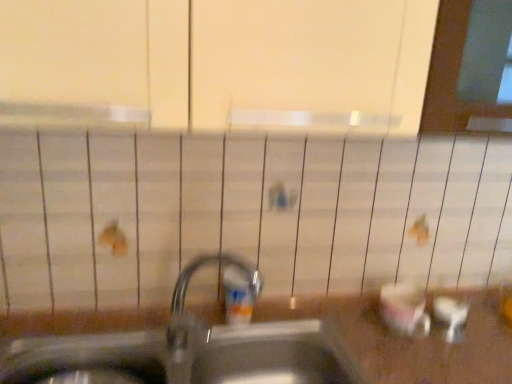
The image size is (512, 384). What do you see at coordinates (186, 351) in the screenshot?
I see `metallic sink at center` at bounding box center [186, 351].

The width and height of the screenshot is (512, 384). I want to click on metallic sink at center, so click(186, 351).

Where is `translucent plastic soap dispenser at center`? This screenshot has width=512, height=384. translucent plastic soap dispenser at center is located at coordinates (239, 295).

Describe the element at coordinates (239, 295) in the screenshot. I see `translucent plastic soap dispenser at center` at that location.

Locate an element on the screen. The height and width of the screenshot is (384, 512). metallic sink at center is located at coordinates (x=186, y=351).

Does metallic sink at center appear on the right side of translucent plastic soap dispenser at center?

No.

In the image, is metallic sink at center positioned in front of or behind translucent plastic soap dispenser at center?

Clearly, metallic sink at center is in front of translucent plastic soap dispenser at center.

Does point (30, 364) come closer to viewer compared to point (233, 268)?

Yes, it is in front of point (233, 268).

Looking at this image, from the image's perspective, is metallic sink at center located above translucent plastic soap dispenser at center?

Actually, metallic sink at center appears below translucent plastic soap dispenser at center in the image.

From a real-world perspective, relative to translucent plastic soap dispenser at center, is metallic sink at center vertically above or below?

Clearly, from a real-world perspective, metallic sink at center is below translucent plastic soap dispenser at center.

Does metallic sink at center have a lesser width compared to translucent plastic soap dispenser at center?

In fact, metallic sink at center might be wider than translucent plastic soap dispenser at center.

Considering the sizes of objects metallic sink at center and translucent plastic soap dispenser at center in the image provided, who is shorter, metallic sink at center or translucent plastic soap dispenser at center?

translucent plastic soap dispenser at center is shorter.

Between metallic sink at center and translucent plastic soap dispenser at center, which one has smaller size?

Smaller between the two is translucent plastic soap dispenser at center.

Is translucent plastic soap dispenser at center inside metallic sink at center?

No.

Are metallic sink at center and translucent plastic soap dispenser at center located far from each other?

No, metallic sink at center is not far away from translucent plastic soap dispenser at center.

Does metallic sink at center turn towards translucent plastic soap dispenser at center?

No, metallic sink at center is not turned towards translucent plastic soap dispenser at center.

How different are the orientations of metallic sink at center and translucent plastic soap dispenser at center in degrees?

The facing directions of metallic sink at center and translucent plastic soap dispenser at center are 0.661 degrees apart.

Find the location of a particular element. This screenshot has height=384, width=512. toiletry behind the metallic sink at center is located at coordinates (239, 295).

Considering the positions of objects translucent plastic soap dispenser at center and metallic sink at center in the image provided, who is more to the left, translucent plastic soap dispenser at center or metallic sink at center?

Positioned to the left is metallic sink at center.

Does translucent plastic soap dispenser at center come behind metallic sink at center?

Yes, the depth of translucent plastic soap dispenser at center is greater than that of metallic sink at center.

Is point (226, 307) positioned before point (247, 372)?

No, it is not.

From the image's perspective, is translucent plastic soap dispenser at center above or below metallic sink at center?

translucent plastic soap dispenser at center is situated higher than metallic sink at center in the image.

From a real-world perspective, between translucent plastic soap dispenser at center and metallic sink at center, who is vertically higher?

translucent plastic soap dispenser at center.

Considering the sizes of objects translucent plastic soap dispenser at center and metallic sink at center in the image provided, who is thinner, translucent plastic soap dispenser at center or metallic sink at center?

Thinner between the two is translucent plastic soap dispenser at center.

In terms of height, does translucent plastic soap dispenser at center look taller or shorter compared to metallic sink at center?

Considering their sizes, translucent plastic soap dispenser at center has less height than metallic sink at center.

Which of these two, translucent plastic soap dispenser at center or metallic sink at center, is bigger?

metallic sink at center is bigger.

Would you say metallic sink at center is part of translucent plastic soap dispenser at center's contents?

That's incorrect, metallic sink at center is not inside translucent plastic soap dispenser at center.

Is translucent plastic soap dispenser at center not close to metallic sink at center?

No, translucent plastic soap dispenser at center is in close proximity to metallic sink at center.

Consider the image. Is translucent plastic soap dispenser at center turned away from metallic sink at center?

translucent plastic soap dispenser at center does not have its back to metallic sink at center.

How different are the orientations of translucent plastic soap dispenser at center and metallic sink at center in degrees?

The angular difference between translucent plastic soap dispenser at center and metallic sink at center is 0.661 degrees.

This screenshot has width=512, height=384. Identify the location of toiletry behind the metallic sink at center. (239, 295).

Find the location of a particular element. This screenshot has width=512, height=384. toiletry positioned vertically above the metallic sink at center (from a real-world perspective) is located at coordinates [239, 295].

Locate an element on the screen. This screenshot has width=512, height=384. sink in front of the translucent plastic soap dispenser at center is located at coordinates (186, 351).